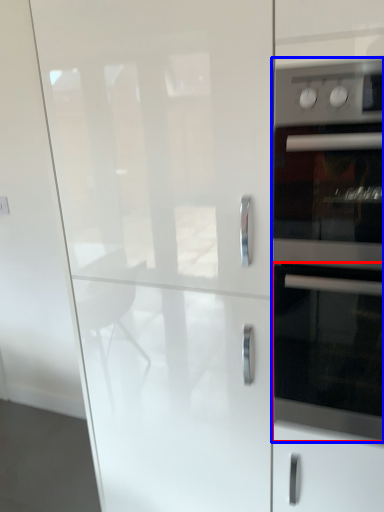
Question: Which object appears closest to the camera in this image, oven (highlighted by a red box) or home appliance (highlighted by a blue box)?

Choices:
 (A) oven
 (B) home appliance

Answer: (B)